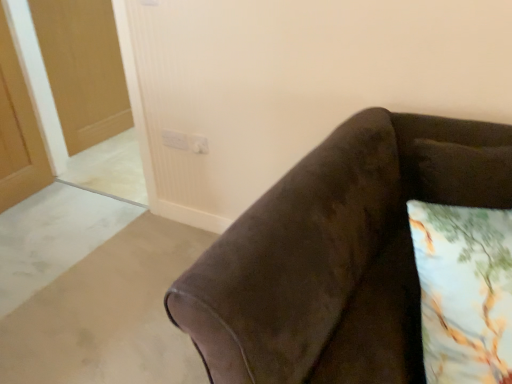
Question: From the image's perspective, is white plastic electric outlet at upper center, which is counted as the second electric outlet, starting from the right, above or below printed fabric pillow at lower right?

Choices:
 (A) below
 (B) above

Answer: (B)

Question: Visually, is white plastic electric outlet at upper center, which is counted as the first electric outlet, starting from the left, positioned to the left or to the right of printed fabric pillow at lower right?

Choices:
 (A) left
 (B) right

Answer: (A)

Question: Based on their relative distances, which object is farther from the white plastic electric outlet at upper center, which is counted as the first electric outlet, starting from the left?

Choices:
 (A) white plastic electric outlet at upper center, arranged as the first electric outlet when viewed from the right
 (B) printed fabric pillow at lower right
 (C) matte wooden door at upper left

Answer: (B)

Question: Which object is the closest to the white plastic electric outlet at upper center, arranged as the first electric outlet when viewed from the right?

Choices:
 (A) printed fabric pillow at lower right
 (B) white plastic electric outlet at upper center, which is counted as the second electric outlet, starting from the right
 (C) matte wooden door at upper left

Answer: (B)